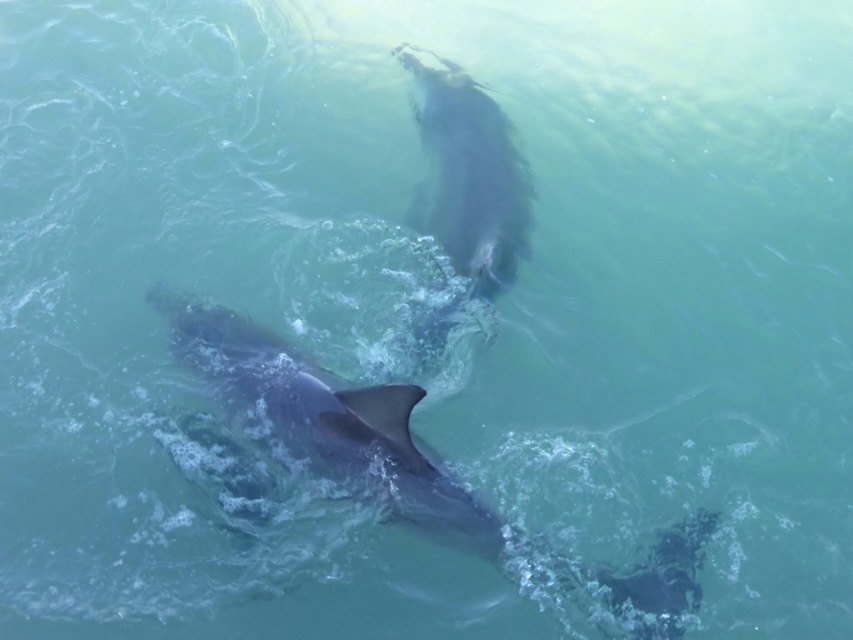
Is gray smooth dolphin at center shorter than gray matte whale at upper center?

Indeed, gray smooth dolphin at center has a lesser height compared to gray matte whale at upper center.

Which is above, gray smooth dolphin at center or gray matte whale at upper center?

gray matte whale at upper center is above.

Where is `gray smooth dolphin at center`? The height and width of the screenshot is (640, 853). gray smooth dolphin at center is located at coordinates (334, 420).